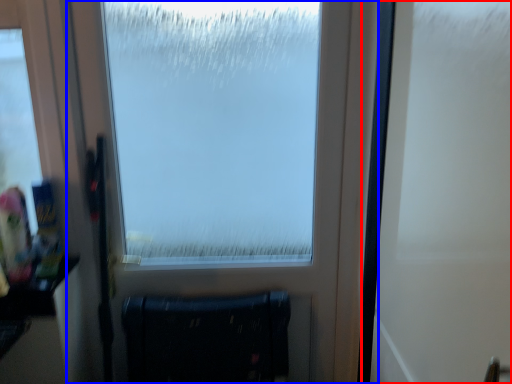
Question: Among these objects, which one is farthest to the camera, screen door (highlighted by a red box) or window (highlighted by a blue box)?

Choices:
 (A) screen door
 (B) window

Answer: (B)